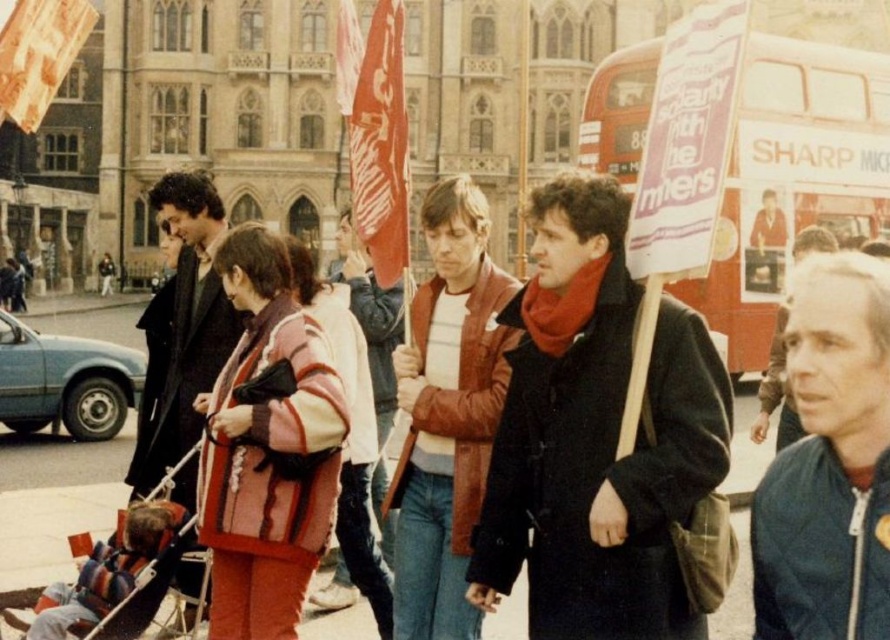
Based on the photo, who is lower down, red double-decker bus at center or dark brown leather coat at left?

dark brown leather coat at left is lower down.

Which is behind, point (806, 209) or point (209, 218)?

Point (806, 209)

Which is in front, point (887, 157) or point (221, 355)?

Point (221, 355)

Locate an element on the screen. red double-decker bus at center is located at coordinates (x=791, y=179).

Is point (547, 579) behind point (814, 163)?

No, (547, 579) is in front of (814, 163).

Who is higher up, matte black coat at center or red double-decker bus at center?

red double-decker bus at center is higher up.

Is point (592, 259) closer to camera compared to point (837, 99)?

Yes, point (592, 259) is closer to viewer.

Identify the location of matte black coat at center. (596, 436).

Between matte black coat at center and dark brown leather coat at left, which one appears on the left side from the viewer's perspective?

dark brown leather coat at left

Which is more to the right, matte black coat at center or dark brown leather coat at left?

matte black coat at center is more to the right.

Is point (646, 637) more distant than point (175, 488)?

No, it is not.

The image size is (890, 640). Identify the location of matte black coat at center. (596, 436).